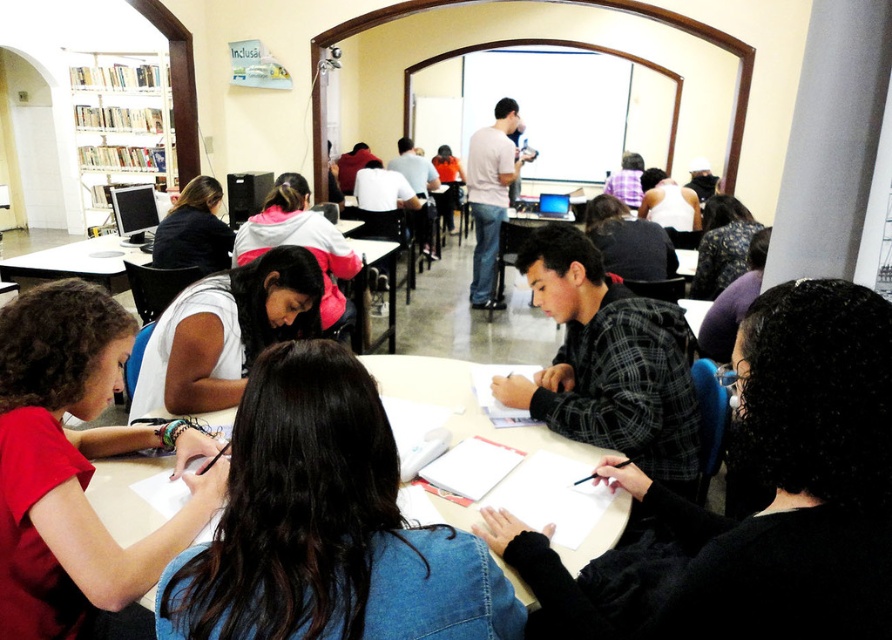
Question: Which object is the farthest from the white plastic table at lower left?

Choices:
 (A) matte red shirt at lower left
 (B) white matte shirt at center
 (C) white paper at center

Answer: (A)

Question: Can you confirm if matte red shirt at lower left is positioned below white paper at center?

Choices:
 (A) yes
 (B) no

Answer: (A)

Question: Does white matte shirt at center have a lesser width compared to white paper at center?

Choices:
 (A) yes
 (B) no

Answer: (A)

Question: Which point appears farthest from the camera in this image?

Choices:
 (A) (117, 236)
 (B) (71, 579)
 (C) (277, 257)

Answer: (A)

Question: Which of the following is the closest to the observer?

Choices:
 (A) (19, 278)
 (B) (591, 540)
 (C) (80, 154)
 (D) (73, 416)

Answer: (D)

Question: In this image, where is white matte shirt at center located relative to white plastic table at lower left?

Choices:
 (A) below
 (B) above

Answer: (A)